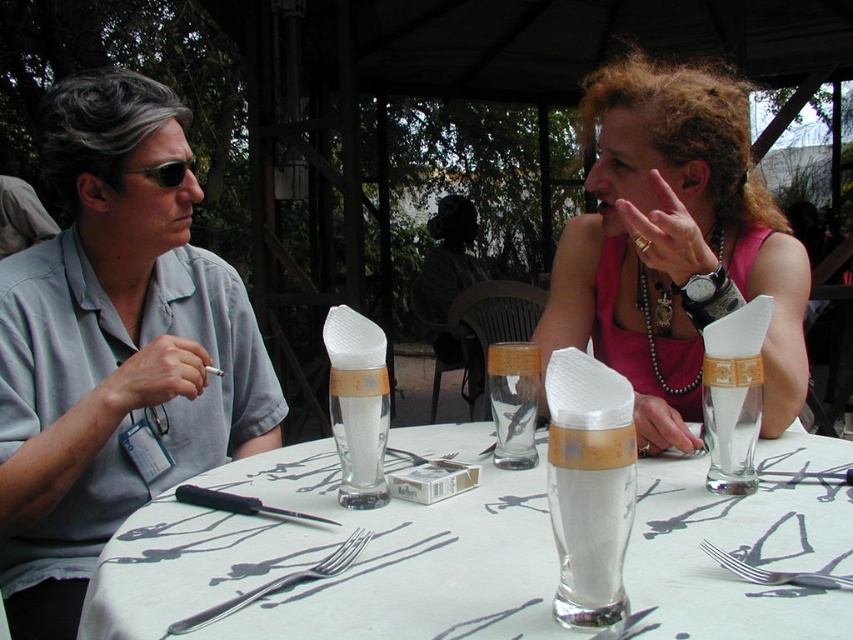
Question: Which point is farther from the camera taking this photo?

Choices:
 (A) (618, 513)
 (B) (357, 529)
 (C) (6, 544)
 (D) (717, 556)

Answer: (C)

Question: Can you confirm if white paper napkin at center is positioned above silver metallic fork at center?

Choices:
 (A) no
 (B) yes

Answer: (B)

Question: Does white paper napkin at center appear on the right side of gray cotton shirt at left?

Choices:
 (A) yes
 (B) no

Answer: (A)

Question: Which object is closer to the camera taking this photo?

Choices:
 (A) translucent glass at center
 (B) silver metallic fork at center
 (C) white paper napkin at center

Answer: (C)

Question: Does white paper napkin at center have a greater width compared to translucent glass at center?

Choices:
 (A) yes
 (B) no

Answer: (A)

Question: Which point is closer to the camera taking this photo?

Choices:
 (A) (714, 236)
 (B) (770, 576)
 (C) (312, 572)

Answer: (B)